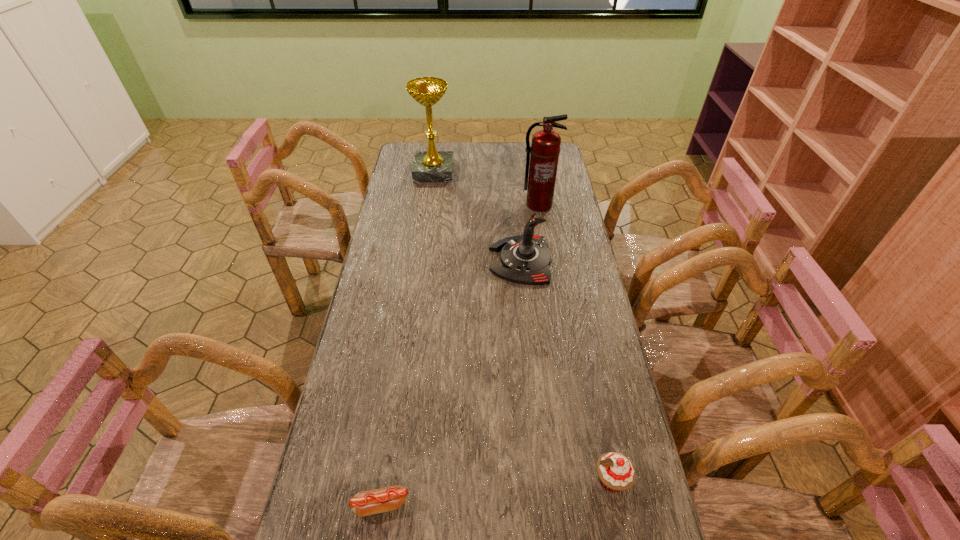
Where is `free space that satisfies the following two spatial constraints: 1. on the back side of the cupcake; 2. on the handle side of the third shortest object`? The image size is (960, 540). free space that satisfies the following two spatial constraints: 1. on the back side of the cupcake; 2. on the handle side of the third shortest object is located at coordinates (566, 260).